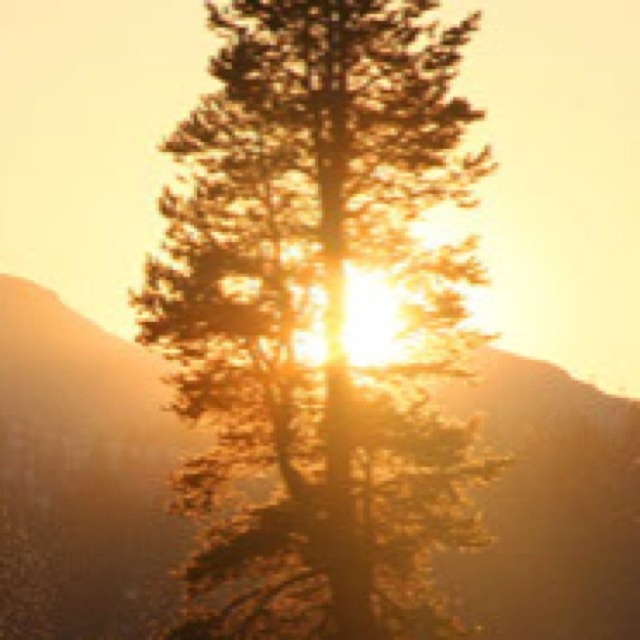
Which of these two, brown textured tree at center or matte brown mountain at center, stands shorter?

With less height is matte brown mountain at center.

Can you confirm if brown textured tree at center is positioned to the right of matte brown mountain at center?

In fact, brown textured tree at center is to the left of matte brown mountain at center.

The height and width of the screenshot is (640, 640). Identify the location of brown textured tree at center. (320, 312).

Image resolution: width=640 pixels, height=640 pixels. What are the coordinates of `brown textured tree at center` in the screenshot? It's located at (320, 312).